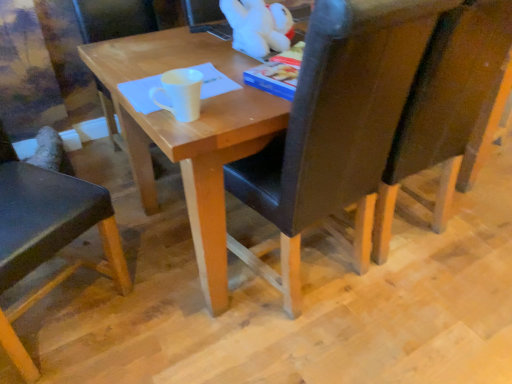
Question: From the image's perspective, is white matte mug at center positioned above or below matte wood chair at center, which ranks as the second chair in left-to-right order?

Choices:
 (A) above
 (B) below

Answer: (B)

Question: Looking at the image, does white matte mug at center seem bigger or smaller compared to matte wood chair at center, arranged as the 3th chair when viewed from the right?

Choices:
 (A) small
 (B) big

Answer: (A)

Question: Estimate the real-world distances between objects in this image. Which object is closer to the matte wood chair at center, which ranks as the second chair in left-to-right order?

Choices:
 (A) white matte mug at center
 (B) black leather chair at center, which is counted as the second chair, starting from the right
 (C) matte black chair at left, arranged as the 1th chair when viewed from the left
 (D) white plush toy at upper center
 (E) dark brown leather chair at right, the fourth chair positioned from the left

Answer: (D)

Question: Estimate the real-world distances between objects in this image. Which object is farther from the matte wood chair at center, arranged as the 3th chair when viewed from the right?

Choices:
 (A) black leather chair at center, which is counted as the second chair, starting from the right
 (B) white plush toy at upper center
 (C) dark brown leather chair at right, the first chair when ordered from right to left
 (D) matte black chair at left, the 4th chair from the right
 (E) white matte mug at center

Answer: (C)